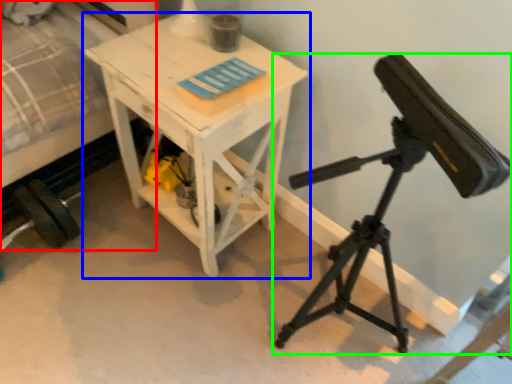
Question: Based on their relative distances, which object is farther from bed (highlighted by a red box)? Choose from table (highlighted by a blue box) and tripod (highlighted by a green box).

Choices:
 (A) table
 (B) tripod

Answer: (B)